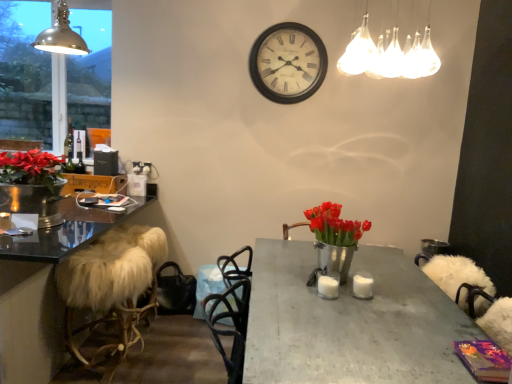
Where is `vacant area that is in front of white matte candle at center, which is the 2th candle from right to left`? This screenshot has width=512, height=384. vacant area that is in front of white matte candle at center, which is the 2th candle from right to left is located at coordinates (336, 304).